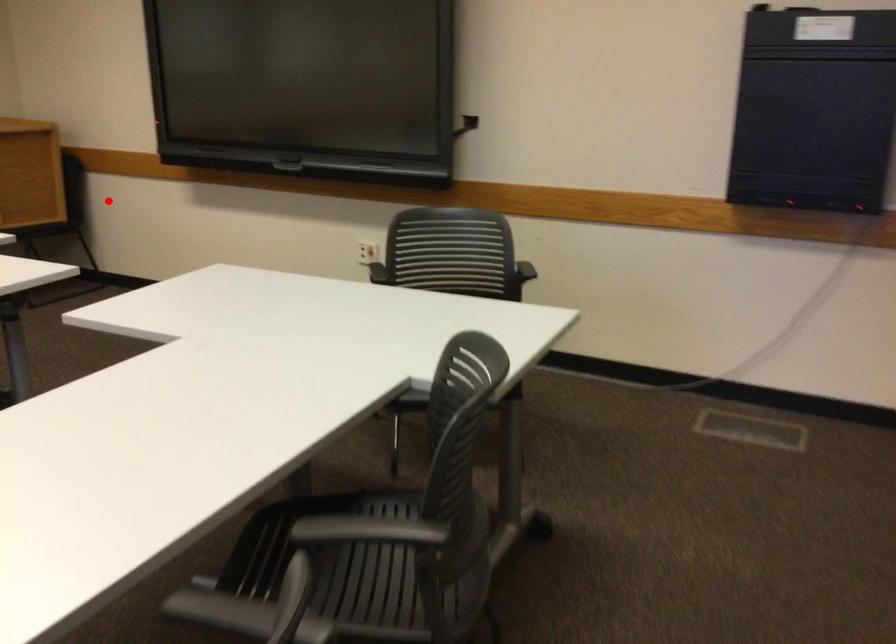
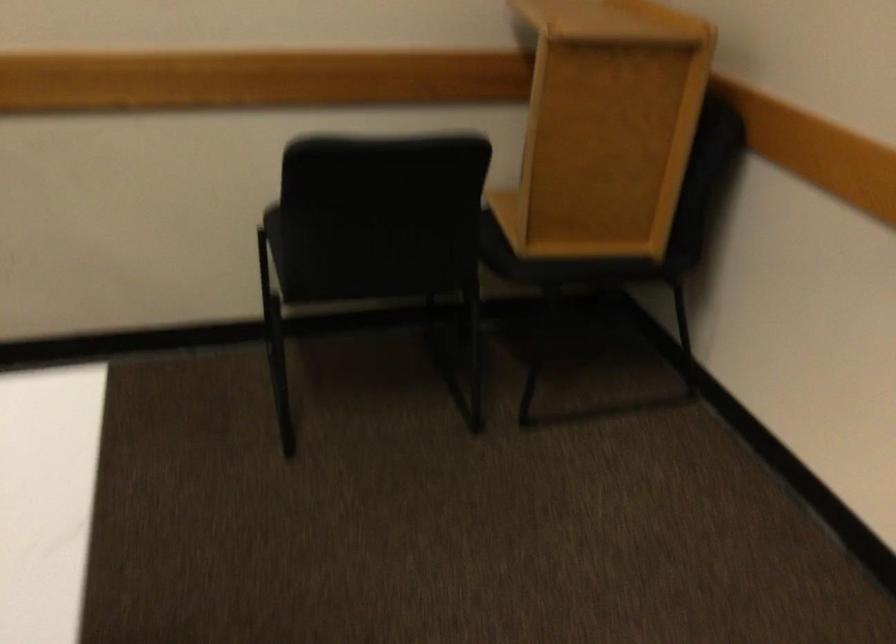
Locate, in the second image, the point that corresponds to the highlighted location in the first image.

(586, 263)